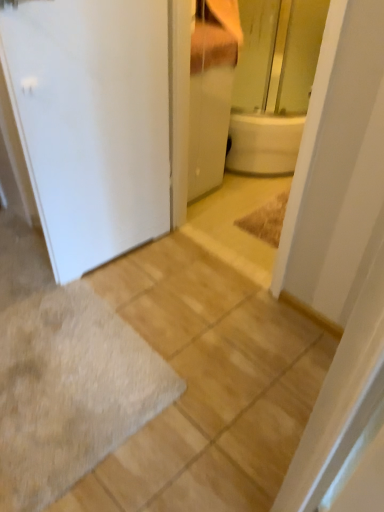
Locate an element on the screen. white matte door at left is located at coordinates (92, 122).

From the image's perspective, is white matte door at left located above gray shaggy bath mat at lower left?

Yes, from the image's perspective, white matte door at left is on top of gray shaggy bath mat at lower left.

Considering the sizes of objects white matte door at left and gray shaggy bath mat at lower left in the image provided, who is wider, white matte door at left or gray shaggy bath mat at lower left?

Wider between the two is gray shaggy bath mat at lower left.

Which is farther, (138, 23) or (86, 450)?

The point (138, 23) is farther from the camera.

From a real-world perspective, who is located higher, white matte door at left or gray shaggy bath mat at lower left?

white matte door at left, from a real-world perspective.

Between gray shaggy bath mat at lower left and white matte door at left, which one appears on the left side from the viewer's perspective?

From the viewer's perspective, gray shaggy bath mat at lower left appears more on the left side.

From the image's perspective, does gray shaggy bath mat at lower left appear lower than white matte door at left?

Yes, from the image's perspective, gray shaggy bath mat at lower left is below white matte door at left.

In the scene shown: From a real-world perspective, is gray shaggy bath mat at lower left above or below white matte door at left?

In terms of real-world spatial position, gray shaggy bath mat at lower left is below white matte door at left.

Does gray shaggy bath mat at lower left have a lesser width compared to white matte door at left?

No, gray shaggy bath mat at lower left is not thinner than white matte door at left.

How far apart are white glossy cabinet at upper center and gray shaggy bath mat at lower left?

white glossy cabinet at upper center is 1.23 meters from gray shaggy bath mat at lower left.

The width and height of the screenshot is (384, 512). In order to click on bathroom cabinet above the gray shaggy bath mat at lower left (from the image's perspective) in this screenshot , I will do `click(211, 91)`.

Visually, is white glossy cabinet at upper center positioned to the left or to the right of gray shaggy bath mat at lower left?

white glossy cabinet at upper center is positioned on gray shaggy bath mat at lower left's right side.

Between point (196, 55) and point (25, 482), which one is positioned behind?

The point (196, 55) is behind.

Is white matte door at left facing towards white glossy cabinet at upper center?

No, white matte door at left is not facing towards white glossy cabinet at upper center.

Locate an element on the screen. The image size is (384, 512). door above the white glossy cabinet at upper center (from a real-world perspective) is located at coordinates (92, 122).

How many degrees apart are the facing directions of white matte door at left and white glossy cabinet at upper center?

The facing directions of white matte door at left and white glossy cabinet at upper center are 2.62 degrees apart.

Which of these two, white matte door at left or white glossy cabinet at upper center, is bigger?

Bigger between the two is white matte door at left.

Does gray shaggy bath mat at lower left have a smaller size compared to white glossy cabinet at upper center?

Yes.

Is gray shaggy bath mat at lower left positioned before white glossy cabinet at upper center?

Yes, it is.

Is gray shaggy bath mat at lower left oriented away from white glossy cabinet at upper center?

No, gray shaggy bath mat at lower left is not facing the opposite direction of white glossy cabinet at upper center.

From a real-world perspective, is gray shaggy bath mat at lower left physically located above or below white glossy cabinet at upper center?

gray shaggy bath mat at lower left is situated lower than white glossy cabinet at upper center in the real world.

Is white glossy cabinet at upper center positioned with its back to white matte door at left?

white glossy cabinet at upper center is not turned away from white matte door at left.

Could white matte door at left be considered to be inside white glossy cabinet at upper center?

No, white matte door at left is not a part of white glossy cabinet at upper center.

From the picture: Which of these two, white glossy cabinet at upper center or white matte door at left, is thinner?

white matte door at left.

Who is bigger, white glossy cabinet at upper center or white matte door at left?

white matte door at left.

You are a GUI agent. You are given a task and a screenshot of the screen. Output one action in this format:
    pyautogui.click(x=<x>, y=<y>)
    Task: Click on the door on the right of gray shaggy bath mat at lower left
    This screenshot has width=384, height=512.
    Given the screenshot: What is the action you would take?
    pyautogui.click(x=92, y=122)

Locate an element on the screen. This screenshot has width=384, height=512. bath mat beneath the white matte door at left (from a real-world perspective) is located at coordinates (70, 391).

Considering their positions, is white glossy cabinet at upper center positioned closer to gray shaggy bath mat at lower left than white matte door at left?

The object closer to gray shaggy bath mat at lower left is white matte door at left.

Based on their spatial positions, is white matte door at left or gray shaggy bath mat at lower left further from white glossy cabinet at upper center?

The object further to white glossy cabinet at upper center is gray shaggy bath mat at lower left.

When comparing their distances from gray shaggy bath mat at lower left, does white matte door at left or white glossy cabinet at upper center seem further?

white glossy cabinet at upper center.

Based on their spatial positions, is gray shaggy bath mat at lower left or white glossy cabinet at upper center further from white matte door at left?

gray shaggy bath mat at lower left is further to white matte door at left.

Based on their spatial positions, is gray shaggy bath mat at lower left or white matte door at left further from white glossy cabinet at upper center?

Based on the image, gray shaggy bath mat at lower left appears to be further to white glossy cabinet at upper center.

From the image, which object appears to be nearer to white matte door at left, white glossy cabinet at upper center or gray shaggy bath mat at lower left?

The object closer to white matte door at left is white glossy cabinet at upper center.

Where is `door between white glossy cabinet at upper center and gray shaggy bath mat at lower left from top to bottom`? door between white glossy cabinet at upper center and gray shaggy bath mat at lower left from top to bottom is located at coordinates (92, 122).